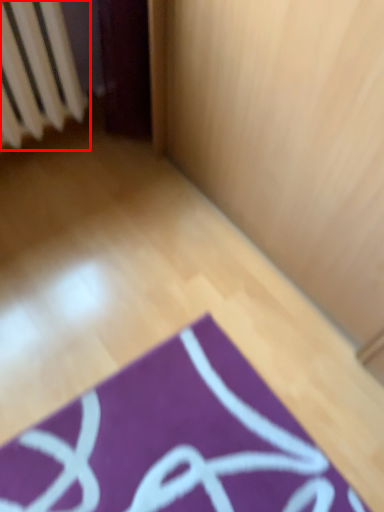
Question: Observing the image, what is the correct spatial positioning of radiator (annotated by the red box) in reference to yoga mat?

Choices:
 (A) right
 (B) left

Answer: (B)